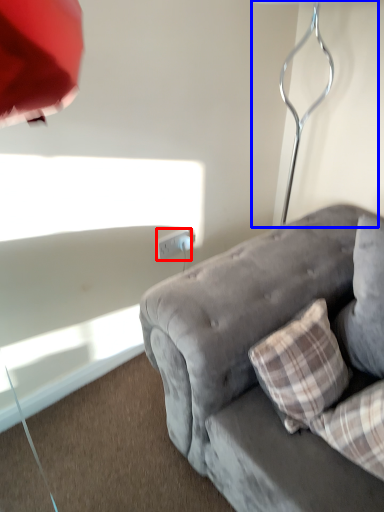
Question: Which object is closer to the camera taking this photo, power outlet (highlighted by a red box) or table lamp (highlighted by a blue box)?

Choices:
 (A) power outlet
 (B) table lamp

Answer: (B)